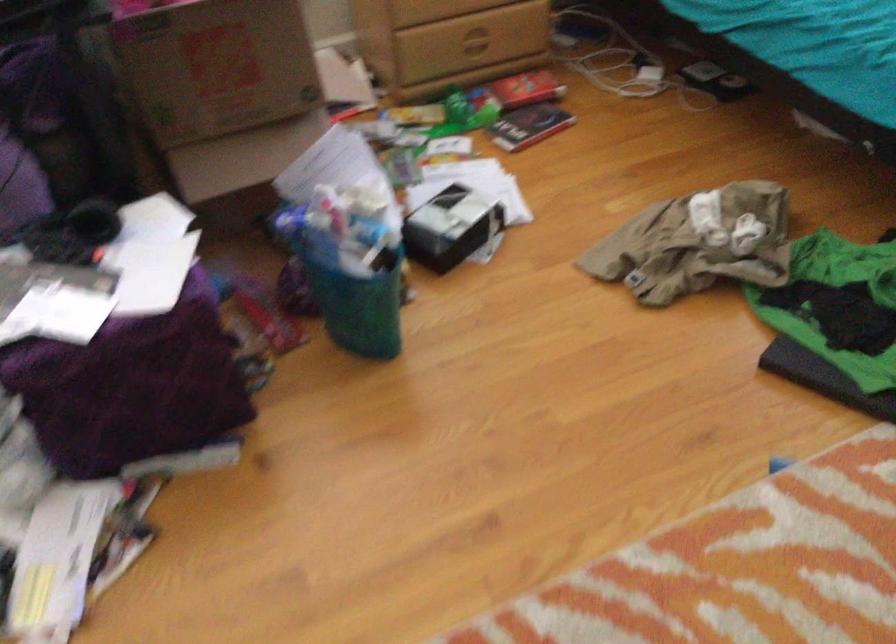
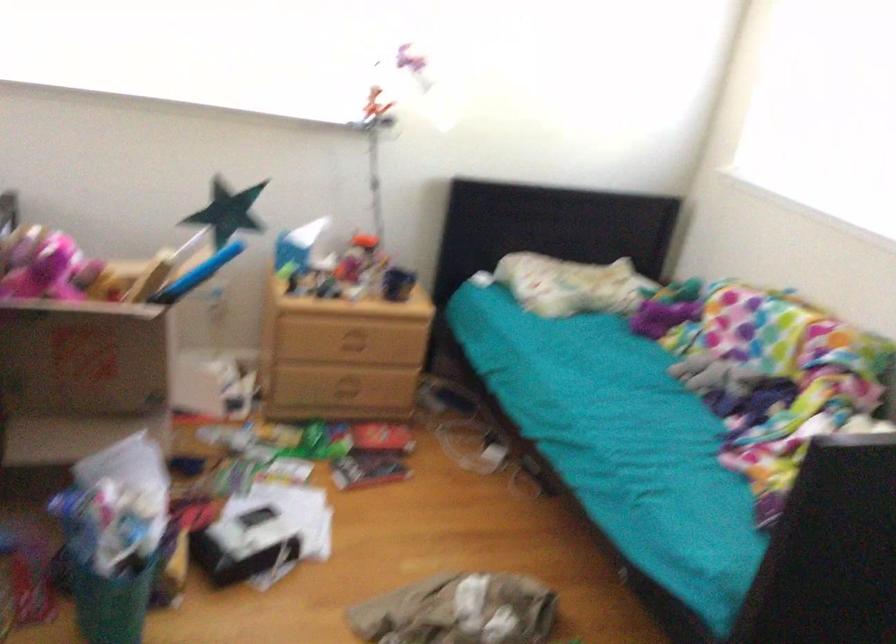
In the second image, find the point that corresponds to (x=367, y=297) in the first image.

(108, 592)